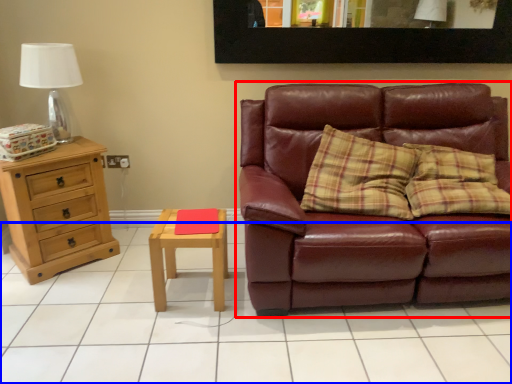
Question: Which point is closer to the camera, studio couch (highlighted by a red box) or tile (highlighted by a blue box)?

Choices:
 (A) studio couch
 (B) tile

Answer: (B)